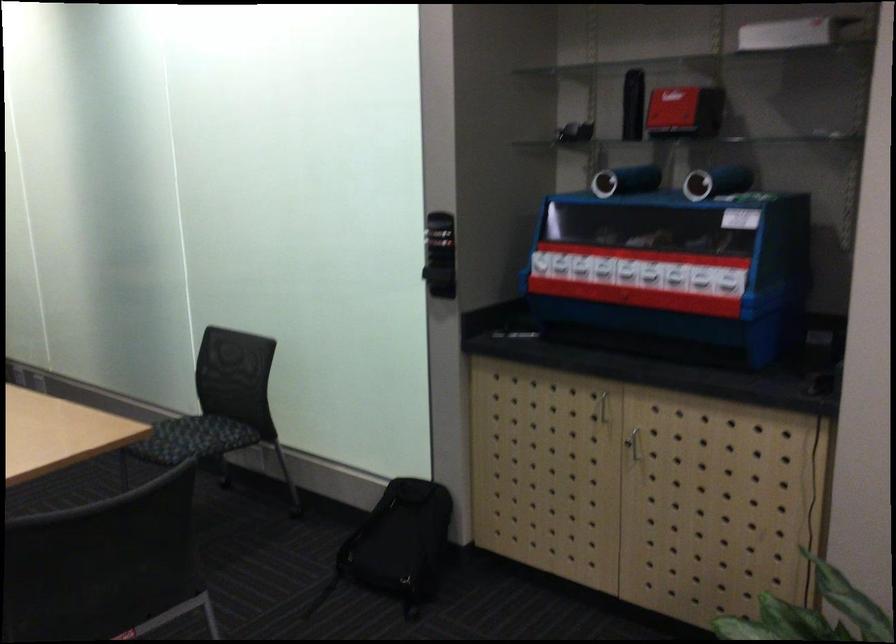
Where would you sit the chair sitting surface? Please return your answer as a coordinate pair (x, y).

(194, 439)